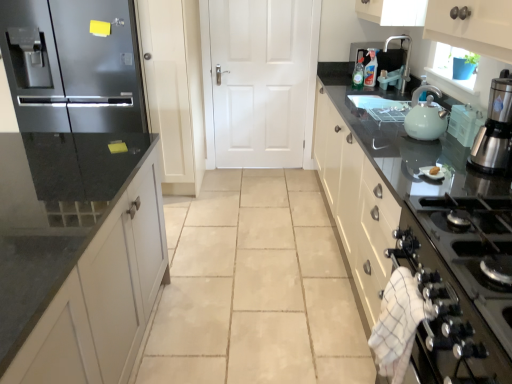
What do you see at coordinates (495, 129) in the screenshot?
I see `stainless steel coffee maker at upper right` at bounding box center [495, 129].

Measure the distance between point (426, 97) and camera.

Point (426, 97) is 7.00 feet from camera.

Describe the element at coordinates (434, 170) in the screenshot. The width and height of the screenshot is (512, 384). I see `white matte bread at center` at that location.

Find the location of `shiny black countertop at right`. shiny black countertop at right is located at coordinates (413, 226).

What do you see at coordinates (474, 251) in the screenshot? I see `white glossy gas stove at lower right` at bounding box center [474, 251].

Looking at this image, measure the distance between point (x=300, y=41) and camera.

Point (x=300, y=41) and camera are 11.68 feet apart.

Where is `stainless steel coffee maker at upper right`? The width and height of the screenshot is (512, 384). stainless steel coffee maker at upper right is located at coordinates (495, 129).

From a real-world perspective, is shiny black countertop at right located beneath white matte bread at center?

Correct, in the physical world, shiny black countertop at right is lower than white matte bread at center.

Would you say shiny black countertop at right is a long distance from white matte bread at center?

They are positioned close to each other.

Is shiny black countertop at right not within white matte bread at center?

Yes.

Looking at this image, from the image's perspective, is shiny black countertop at right located above or below matte white kettle at right?

Clearly, from the image's perspective, shiny black countertop at right is below matte white kettle at right.

Is shiny black countertop at right aimed at matte white kettle at right?

No, shiny black countertop at right is not aimed at matte white kettle at right.

Is shiny black countertop at right wider or thinner than matte white kettle at right?

In the image, shiny black countertop at right appears to be wider than matte white kettle at right.

Considering the relative sizes of shiny black countertop at right and matte white kettle at right in the image provided, is shiny black countertop at right shorter than matte white kettle at right?

Incorrect, the height of shiny black countertop at right does not fall short of that of matte white kettle at right.

Does point (434, 168) appear closer or farther from the camera than point (51, 121)?

Point (434, 168).

Is white matte bread at center bigger or smaller than matte black refrigerator at left?

Clearly, white matte bread at center is smaller in size than matte black refrigerator at left.

From the image's perspective, between white matte bread at center and matte black refrigerator at left, which one is located above?

From the image's view, matte black refrigerator at left is above.

From a real-world perspective, is white matte bread at center under matte black refrigerator at left?

Incorrect, from a real-world perspective, white matte bread at center is higher than matte black refrigerator at left.

Is matte black refrigerator at left oriented towards shiny black countertop at right?

No, matte black refrigerator at left does not turn towards shiny black countertop at right.

Does matte black refrigerator at left contain shiny black countertop at right?

No, matte black refrigerator at left does not contain shiny black countertop at right.

From the image's perspective, is matte black refrigerator at left over shiny black countertop at right?

Correct, matte black refrigerator at left appears higher than shiny black countertop at right in the image.

Based on the photo, which is more to the right, matte black refrigerator at left or shiny black countertop at right?

shiny black countertop at right.

From the image's perspective, between white glossy gas stove at lower right and white matte door at center, who is located below?

white glossy gas stove at lower right, from the image's perspective.

What's the angular difference between white glossy gas stove at lower right and white matte door at center's facing directions?

They differ by 90.7 degrees in their facing directions.

Considering the sizes of objects white glossy gas stove at lower right and white matte door at center in the image provided, who is shorter, white glossy gas stove at lower right or white matte door at center?

white glossy gas stove at lower right is shorter.

Is white glossy gas stove at lower right in contact with white matte door at center?

white glossy gas stove at lower right and white matte door at center are not in contact.

Is shiny black countertop at right touching stainless steel coffee maker at upper right?

No, shiny black countertop at right is not touching stainless steel coffee maker at upper right.

From a real-world perspective, between shiny black countertop at right and stainless steel coffee maker at upper right, who is vertically lower?

shiny black countertop at right, from a real-world perspective.

Image resolution: width=512 pixels, height=384 pixels. I want to click on home appliance behind the shiny black countertop at right, so click(495, 129).

Is white matte door at center smaller than clear plastic bottle at upper center?

No, white matte door at center is not smaller than clear plastic bottle at upper center.

Who is taller, white matte door at center or clear plastic bottle at upper center?

Standing taller between the two is white matte door at center.

In the scene shown: Is white matte door at center closer to camera compared to clear plastic bottle at upper center?

No, the depth of white matte door at center is greater than that of clear plastic bottle at upper center.

Is white matte door at center located outside clear plastic bottle at upper center?

Indeed, white matte door at center is completely outside clear plastic bottle at upper center.

Image resolution: width=512 pixels, height=384 pixels. Find the location of `food above the shiny black countertop at right (from a real-world perspective)`. food above the shiny black countertop at right (from a real-world perspective) is located at coordinates (434, 170).

Image resolution: width=512 pixels, height=384 pixels. I want to click on kitchen appliance on the right of shiny black countertop at right, so click(x=425, y=116).

Looking at the image, which one is located further to clear plastic bottle at upper center, stainless steel coffee maker at upper right or matte white kettle at right?

stainless steel coffee maker at upper right is further to clear plastic bottle at upper center.

Consider the image. Considering their positions, is white glossy gas stove at lower right positioned closer to matte black refrigerator at left than white matte bread at center?

Among the two, white matte bread at center is located nearer to matte black refrigerator at left.

Estimate the real-world distances between objects in this image. Which object is closer to stainless steel coffee maker at upper right, matte black refrigerator at left or matte white kettle at right?

Among the two, matte white kettle at right is located nearer to stainless steel coffee maker at upper right.

Looking at the image, which one is located closer to white matte door at center, white glossy gas stove at lower right or shiny black countertop at right?

shiny black countertop at right.

Considering their positions, is stainless steel coffee maker at upper right positioned closer to white glossy gas stove at lower right than clear plastic bottle at upper center?

stainless steel coffee maker at upper right is positioned closer to the anchor white glossy gas stove at lower right.

Considering their positions, is white matte bread at center positioned further to clear plastic bottle at upper center than white glossy gas stove at lower right?

white glossy gas stove at lower right.

Considering their positions, is matte black refrigerator at left positioned further to white matte door at center than clear plastic bottle at upper center?

matte black refrigerator at left is further to white matte door at center.

Looking at the image, which one is located further to matte white kettle at right, matte black refrigerator at left or shiny black countertop at right?

matte black refrigerator at left lies further to matte white kettle at right than the other object.

Find the location of `countertop situated between matte black refrigerator at left and matte white kettle at right from left to right`. countertop situated between matte black refrigerator at left and matte white kettle at right from left to right is located at coordinates [x=413, y=226].

Locate an element on the screen. This screenshot has height=384, width=512. door between matte black refrigerator at left and clear plastic bottle at upper center is located at coordinates (259, 81).

At what (x,y) coordinates should I click in order to perform the action: click on kitchen appliance located between white matte bread at center and white matte door at center in the depth direction. Please return your answer as a coordinate pair (x, y). The image size is (512, 384). Looking at the image, I should click on (425, 116).

Where is `food positioned between shiny black countertop at right and white matte door at center from near to far`? food positioned between shiny black countertop at right and white matte door at center from near to far is located at coordinates (434, 170).